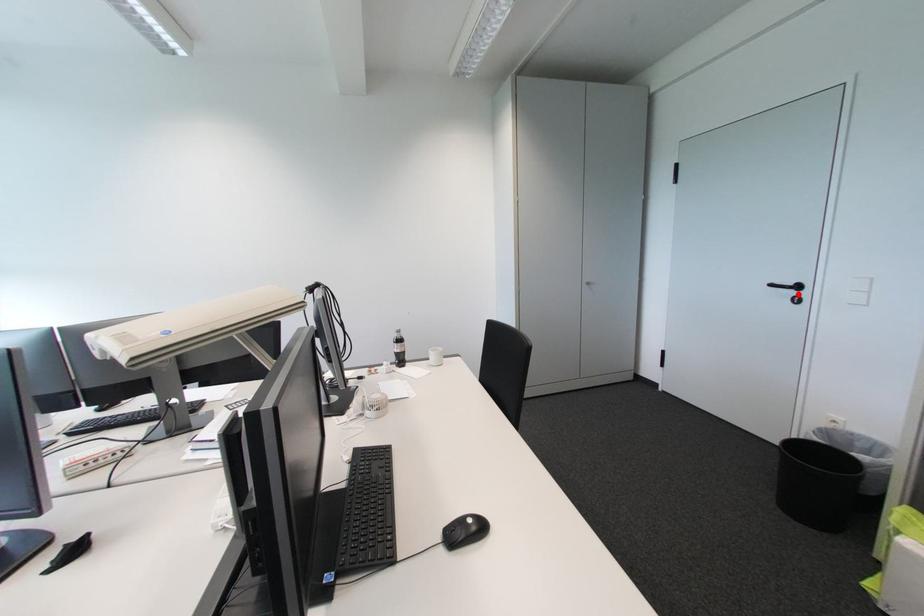
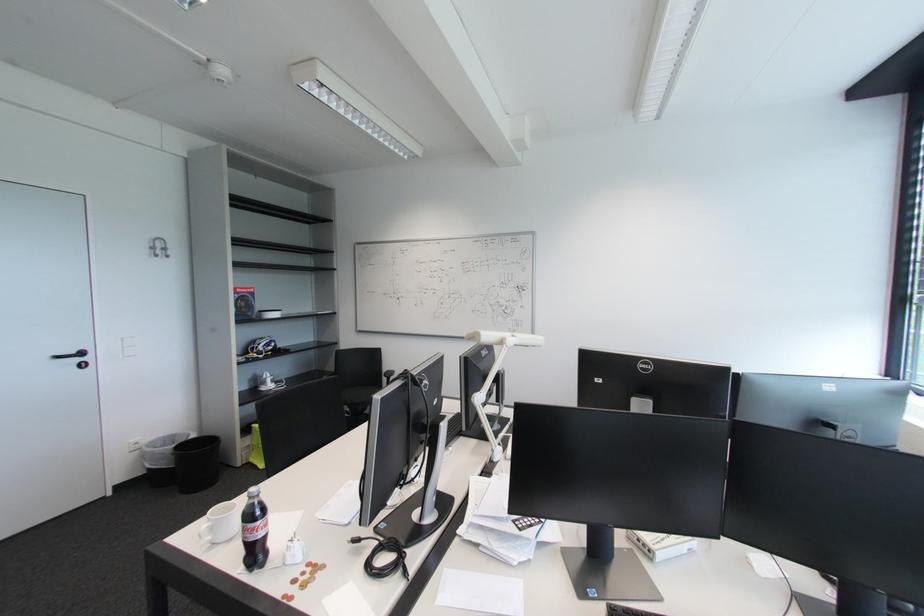
Locate, in the second image, the point that corresponds to the highlighted location in the first image.

(83, 361)